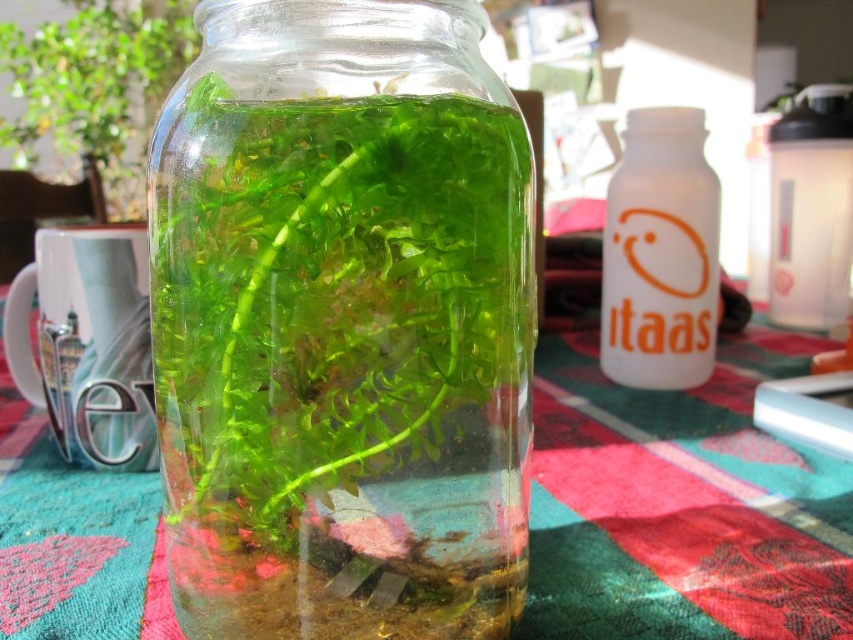
Is green matte plant at center to the left of transparent plastic bottle at upper right from the viewer's perspective?

Indeed, green matte plant at center is positioned on the left side of transparent plastic bottle at upper right.

Does point (96, 138) come in front of point (840, 268)?

No, it is behind (840, 268).

Identify the location of green matte plant at center. The width and height of the screenshot is (853, 640). (97, 84).

Is white matte bottle at center-right shorter than transparent plastic bottle at upper right?

Correct, white matte bottle at center-right is not as tall as transparent plastic bottle at upper right.

Which is above, white matte bottle at center-right or transparent plastic bottle at upper right?

Positioned higher is transparent plastic bottle at upper right.

Which is in front, point (654, 138) or point (801, 164)?

Point (654, 138) is more forward.

This screenshot has height=640, width=853. I want to click on white matte bottle at center-right, so click(660, 253).

In the scene shown: Does white matte bottle at center-right appear under green matte plant at center?

Yes.

Describe the element at coordinates (660, 253) in the screenshot. I see `white matte bottle at center-right` at that location.

Between point (706, 268) and point (131, 48), which one is positioned in front?

Point (706, 268) is more forward.

The height and width of the screenshot is (640, 853). Find the location of `white matte bottle at center-right`. white matte bottle at center-right is located at coordinates (660, 253).